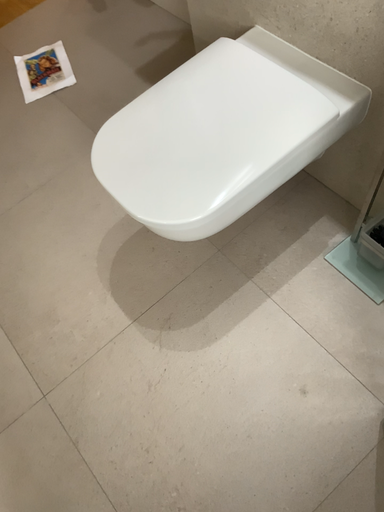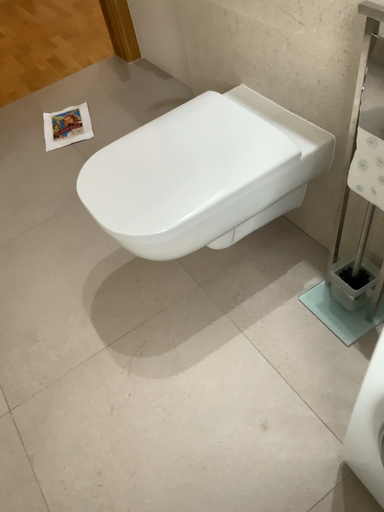
Question: Which way did the camera rotate in the video?

Choices:
 (A) rotated upward
 (B) rotated downward

Answer: (A)